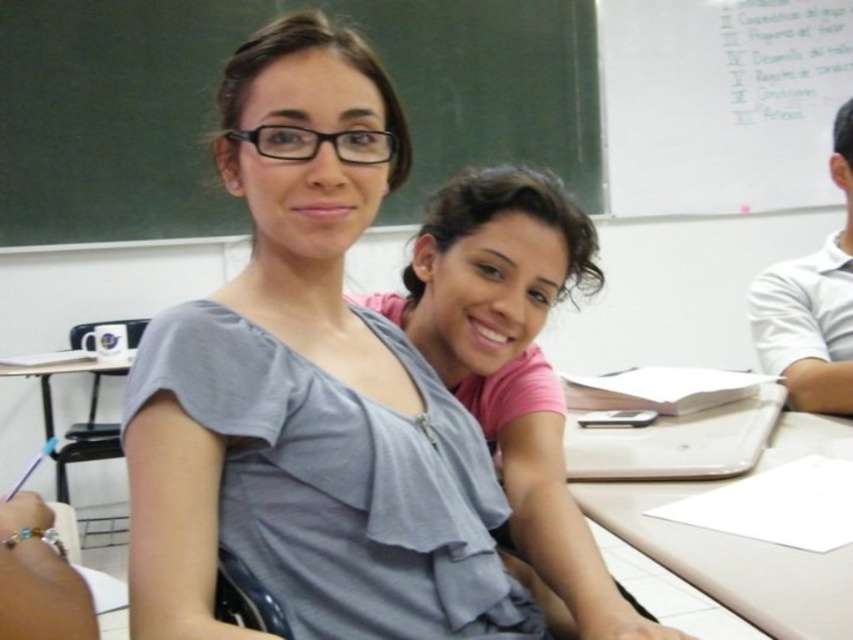
You are organizing a photo shoot and need to ensure that the pink matte shirt at center and the white shirt at right fit within a 1.2 meter wide frame. Based on their widths, will both shirts fit side by side without overlapping?

The pink matte shirt at center might be wider than white shirt at right. Since the total width of both shirts could exceed 1.2 meters, it is uncertain if they will fit side by side without overlapping.

You are a student who needs to place a heavy textbook on the table. Which table should you choose between the white plastic table at center and the metallic silver table at left to ensure it doesn not fall off?

The white plastic table at center is positioned over the metallic silver table at left, so placing the textbook on the white plastic table at center would prevent it from falling off.

You are a student who needs to place a textbook on the nearest table. You are standing in front of the white plastic table at center and the metallic silver table at left. Which table should you choose to place the textbook?

The white plastic table at center is in front of the metallic silver table at left, so the white plastic table at center is closer to you. You should place the textbook on the white plastic table at center.